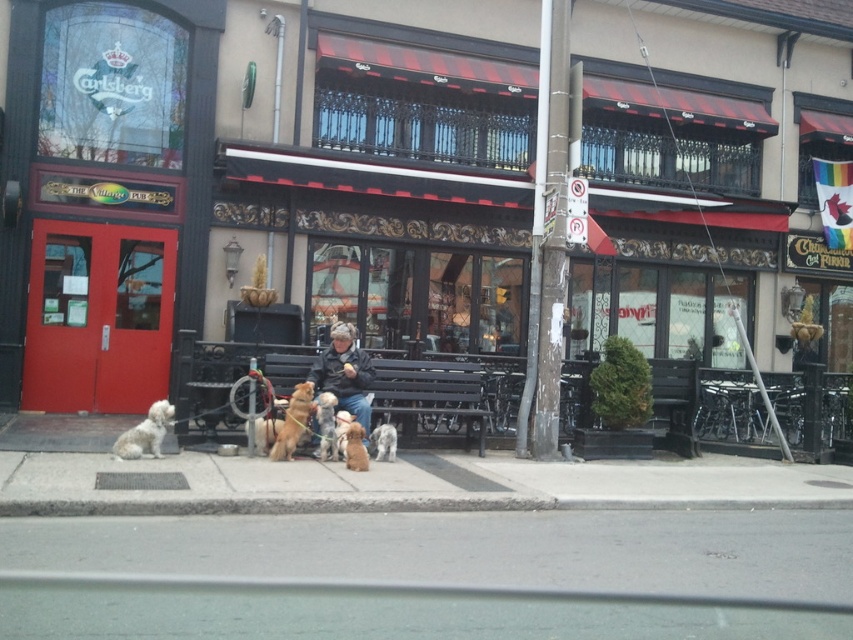
You are a delivery robot that is 1.2 meters wide. You need to navigate through the street scene in front of the pub. There is gray asphalt at lower center and golden brown fur at center in your path. Can you pass through the space between them without hitting either?

The gray asphalt at lower center might be wider than golden brown fur at center, so there is a possibility that the space between them is wide enough for the delivery robot to pass through safely.

You are a delivery person who needs to place a package on the ground near the golden brown fur at center. Based on the scene, where should you place the package so it stays on the gray asphalt at lower center?

The gray asphalt at lower center is below the golden brown fur at center, so placing the package on the gray asphalt at lower center will ensure it stays on the ground beneath the golden brown fur at center.

You are a photographer aiming to capture a detailed shot of the golden brown fur at center and the soft beige fur at center. Given that your camera can only focus on objects within a 30 cm width, will both furs fit within the frame?

The golden brown fur at center is wider than the soft beige fur at center. Since the camera can focus on objects within 30 cm width, but the exact widths aren